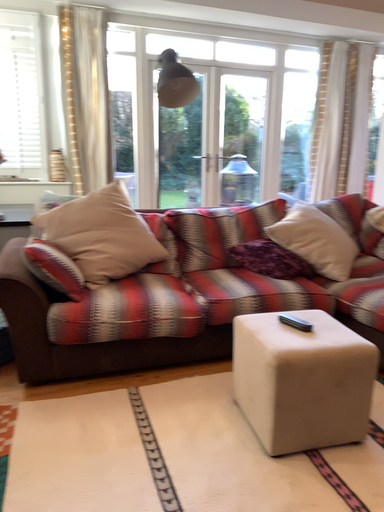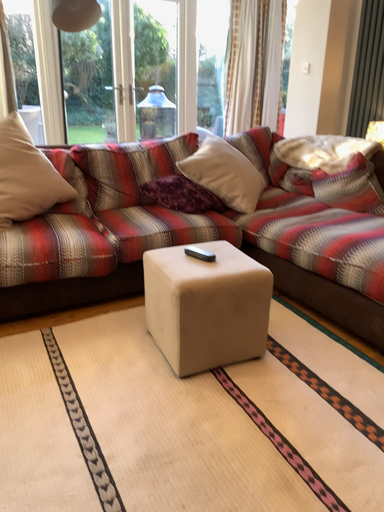
Question: Which way did the camera rotate in the video?

Choices:
 (A) rotated upward
 (B) rotated downward

Answer: (B)